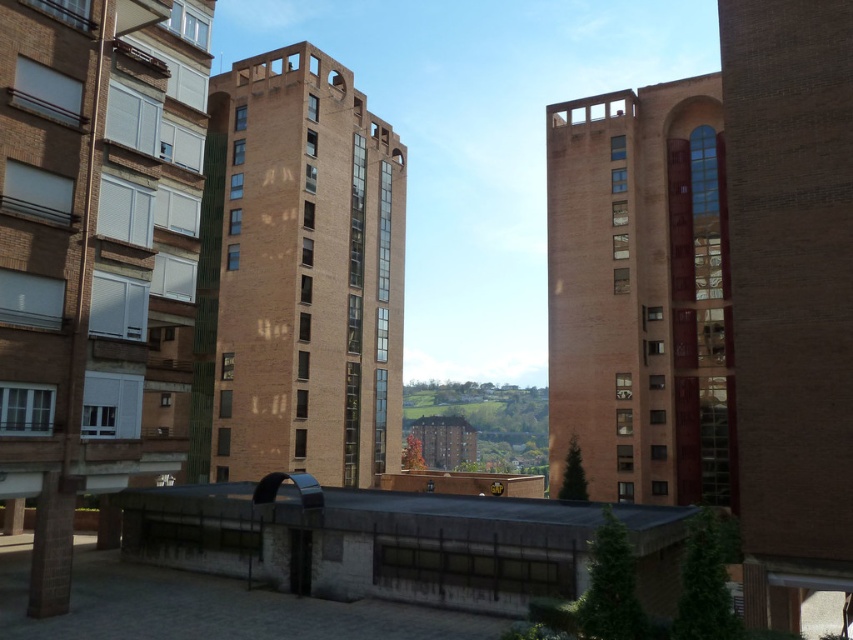
Question: Can you confirm if brown brick building at center is positioned to the left of brick tower at center?

Choices:
 (A) yes
 (B) no

Answer: (A)

Question: Is brown brick building at center below brick tower at center?

Choices:
 (A) no
 (B) yes

Answer: (A)

Question: Among these objects, which one is farthest from the camera?

Choices:
 (A) brick tower at center
 (B) brown brick building at center

Answer: (B)

Question: From the image, what is the correct spatial relationship of brown brick building at center in relation to brick tower at center?

Choices:
 (A) left
 (B) right

Answer: (A)